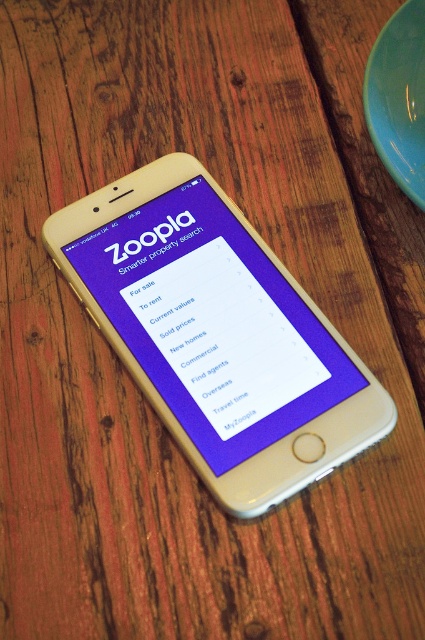
Does purple matte screen at center have a greater height compared to matte green plate at upper right?

Yes, purple matte screen at center is taller than matte green plate at upper right.

Between purple matte screen at center and matte green plate at upper right, which one appears on the right side from the viewer's perspective?

From the viewer's perspective, matte green plate at upper right appears more on the right side.

Who is more forward, [158,291] or [394,147]?

Positioned in front is point [394,147].

Locate an element on the screen. purple matte screen at center is located at coordinates (212, 323).